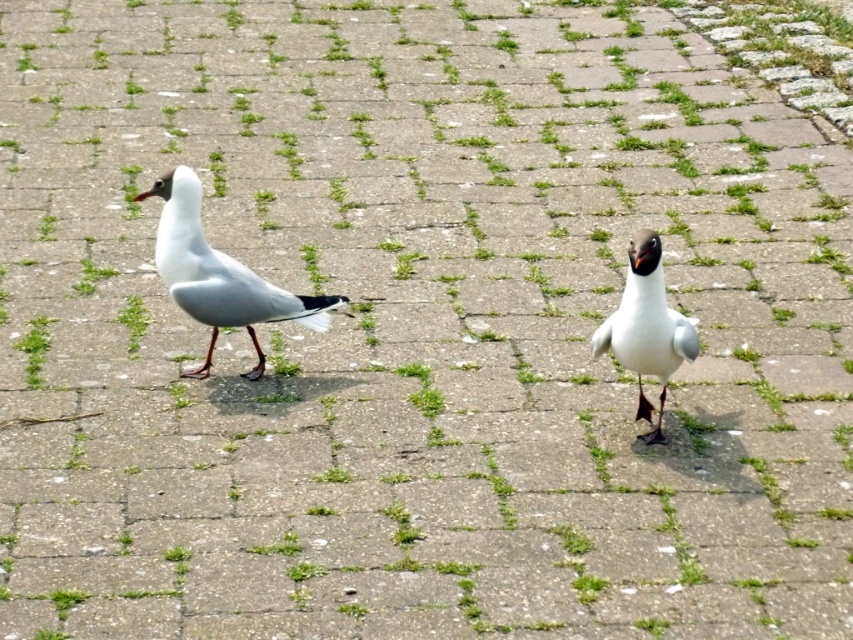
Is white matte bird at left to the left of white matte bird at center from the viewer's perspective?

Yes, white matte bird at left is to the left of white matte bird at center.

Can you confirm if white matte bird at left is thinner than white matte bird at center?

Incorrect, white matte bird at left's width is not less than white matte bird at center's.

Identify the location of white matte bird at left. (219, 275).